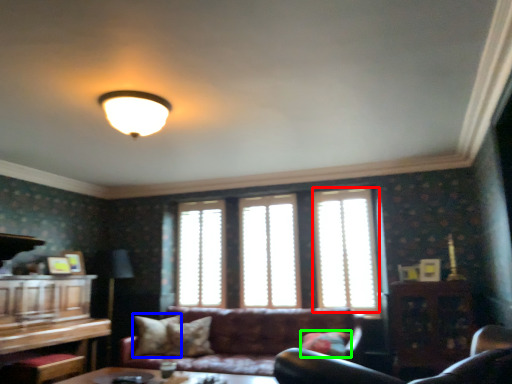
Question: Estimate the real-world distances between objects in this image. Which object is farther from window (highlighted by a red box), pillow (highlighted by a blue box) or pillow (highlighted by a green box)?

Choices:
 (A) pillow
 (B) pillow

Answer: (A)